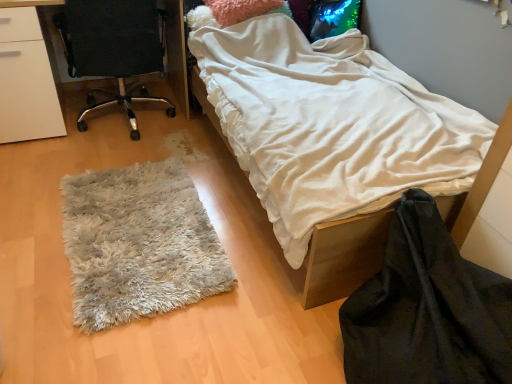
Question: Is white fluffy rug at lower left closer to the viewer compared to black fabric chair at left?

Choices:
 (A) no
 (B) yes

Answer: (B)

Question: Is white fluffy rug at lower left oriented away from black fabric chair at left?

Choices:
 (A) yes
 (B) no

Answer: (B)

Question: Can you confirm if white fluffy rug at lower left is positioned to the left of black fabric chair at left?

Choices:
 (A) no
 (B) yes

Answer: (A)

Question: Can we say white fluffy rug at lower left lies outside black fabric chair at left?

Choices:
 (A) yes
 (B) no

Answer: (A)

Question: Does white fluffy rug at lower left turn towards black fabric chair at left?

Choices:
 (A) no
 (B) yes

Answer: (A)

Question: Considering their positions, is black velvet blanket at lower right located in front of or behind white soft blanket at center?

Choices:
 (A) front
 (B) behind

Answer: (A)

Question: Is black velvet blanket at lower right taller or shorter than white soft blanket at center?

Choices:
 (A) tall
 (B) short

Answer: (B)

Question: From a real-world perspective, relative to white soft blanket at center, is black velvet blanket at lower right vertically above or below?

Choices:
 (A) below
 (B) above

Answer: (A)

Question: From the image's perspective, is black velvet blanket at lower right positioned above or below white soft blanket at center?

Choices:
 (A) below
 (B) above

Answer: (A)

Question: Is point (340, 54) closer or farther from the camera than point (99, 36)?

Choices:
 (A) closer
 (B) farther

Answer: (B)

Question: Is white soft blanket at center wider or thinner than black fabric chair at left?

Choices:
 (A) thin
 (B) wide

Answer: (B)

Question: Based on their sizes in the image, would you say white soft blanket at center is bigger or smaller than black fabric chair at left?

Choices:
 (A) big
 (B) small

Answer: (A)

Question: From the image's perspective, is white soft blanket at center above or below black fabric chair at left?

Choices:
 (A) above
 (B) below

Answer: (B)

Question: Considering the positions of white fluffy rug at lower left and black velvet blanket at lower right in the image, is white fluffy rug at lower left bigger or smaller than black velvet blanket at lower right?

Choices:
 (A) small
 (B) big

Answer: (A)

Question: From a real-world perspective, is white fluffy rug at lower left physically located above or below black velvet blanket at lower right?

Choices:
 (A) above
 (B) below

Answer: (B)